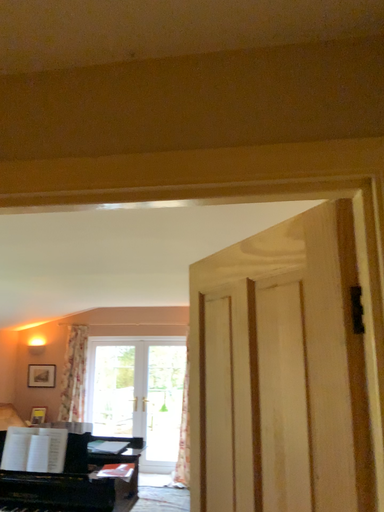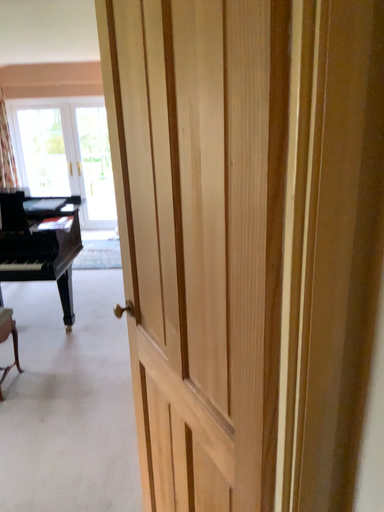
Question: Which way did the camera rotate in the video?

Choices:
 (A) rotated right
 (B) rotated left

Answer: (A)